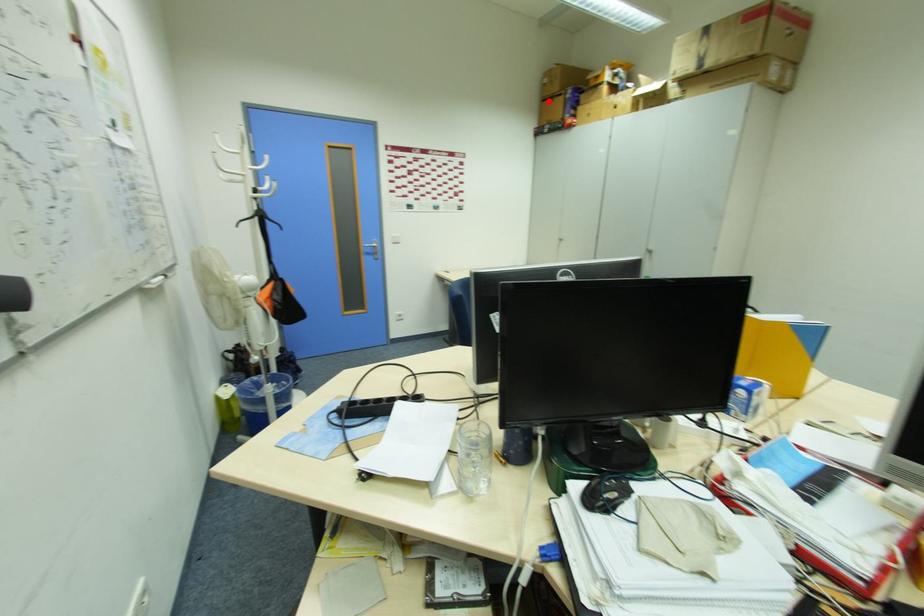
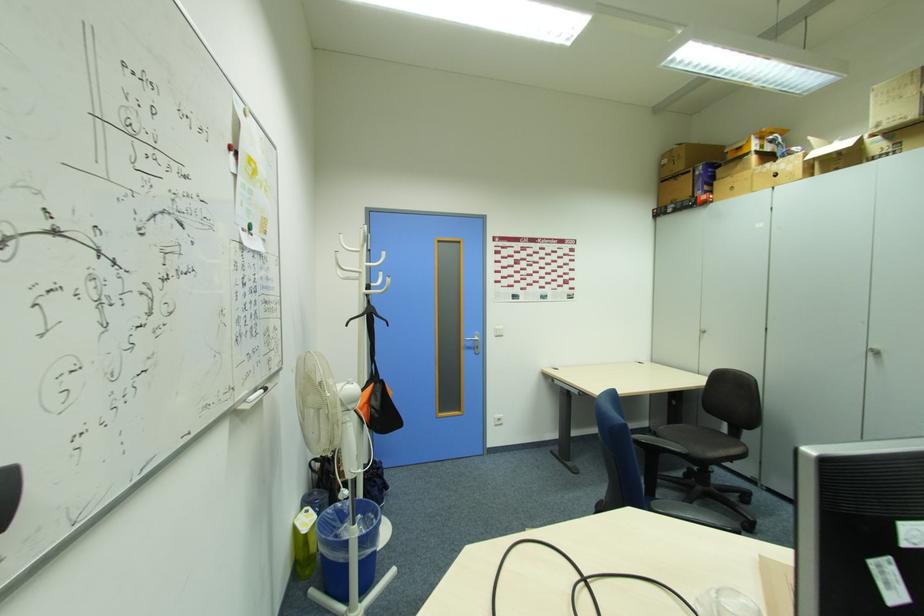
In the second image, find the point that corresponds to the highlighted location in the first image.

(665, 182)